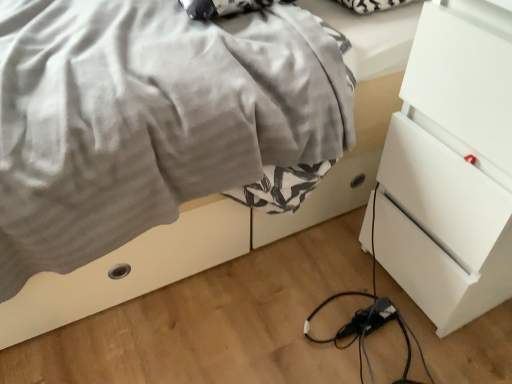
Question: Is satin gray blanket at center to the right of white glossy chest of drawers at right from the viewer's perspective?

Choices:
 (A) yes
 (B) no

Answer: (B)

Question: From the image's perspective, does satin gray blanket at center appear higher than white glossy chest of drawers at right?

Choices:
 (A) yes
 (B) no

Answer: (A)

Question: Does satin gray blanket at center come behind white glossy chest of drawers at right?

Choices:
 (A) no
 (B) yes

Answer: (B)

Question: Is satin gray blanket at center beside white glossy chest of drawers at right?

Choices:
 (A) yes
 (B) no

Answer: (B)

Question: Can you confirm if satin gray blanket at center is thinner than white glossy chest of drawers at right?

Choices:
 (A) no
 (B) yes

Answer: (A)

Question: Is point (503, 271) positioned closer to the camera than point (374, 327)?

Choices:
 (A) farther
 (B) closer

Answer: (B)

Question: Considering their positions, is white glossy chest of drawers at right located in front of or behind black plastic extension cord at lower center?

Choices:
 (A) front
 (B) behind

Answer: (A)

Question: From a real-world perspective, relative to black plastic extension cord at lower center, is white glossy chest of drawers at right vertically above or below?

Choices:
 (A) below
 (B) above

Answer: (B)

Question: In terms of size, does white glossy chest of drawers at right appear bigger or smaller than black plastic extension cord at lower center?

Choices:
 (A) big
 (B) small

Answer: (A)

Question: Is black plastic extension cord at lower center taller or shorter than satin gray blanket at center?

Choices:
 (A) short
 (B) tall

Answer: (A)

Question: From the image's perspective, relative to satin gray blanket at center, is black plastic extension cord at lower center above or below?

Choices:
 (A) below
 (B) above

Answer: (A)

Question: Is black plastic extension cord at lower center situated inside satin gray blanket at center or outside?

Choices:
 (A) inside
 (B) outside

Answer: (B)

Question: Is black plastic extension cord at lower center in front of or behind satin gray blanket at center in the image?

Choices:
 (A) behind
 (B) front

Answer: (A)

Question: In terms of height, does satin gray blanket at center look taller or shorter compared to black plastic extension cord at lower center?

Choices:
 (A) tall
 (B) short

Answer: (A)

Question: Is point coord(303,150) positioned closer to the camera than point coord(384,322)?

Choices:
 (A) closer
 (B) farther

Answer: (A)